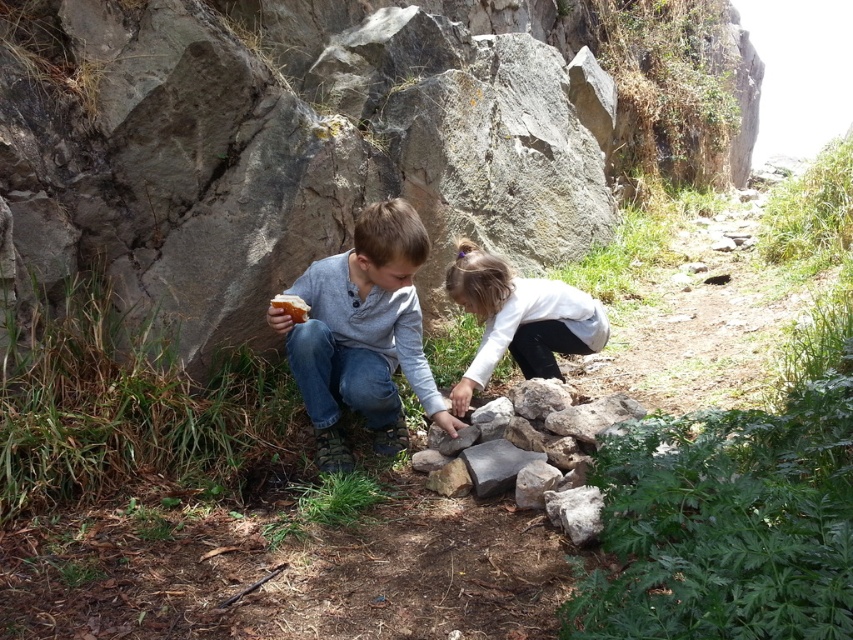
Question: Which object is positioned farthest from the matte gray sweater at center?

Choices:
 (A) gray rough rock at center
 (B) white bread at center
 (C) white matte shirt at center

Answer: (A)

Question: Does rocky at center appear over matte gray sweater at center?

Choices:
 (A) yes
 (B) no

Answer: (A)

Question: Which point is farther to the camera?

Choices:
 (A) gray rough rock at center
 (B) white matte shirt at center

Answer: (B)

Question: Considering the relative positions of gray rough rock at center and white bread at center in the image provided, where is gray rough rock at center located with respect to white bread at center?

Choices:
 (A) right
 (B) left

Answer: (A)

Question: Is rocky at center wider than white matte shirt at center?

Choices:
 (A) yes
 (B) no

Answer: (A)

Question: Among these objects, which one is farthest from the camera?

Choices:
 (A) gray rough rock at center
 (B) white bread at center
 (C) matte gray sweater at center
 (D) white matte shirt at center

Answer: (D)